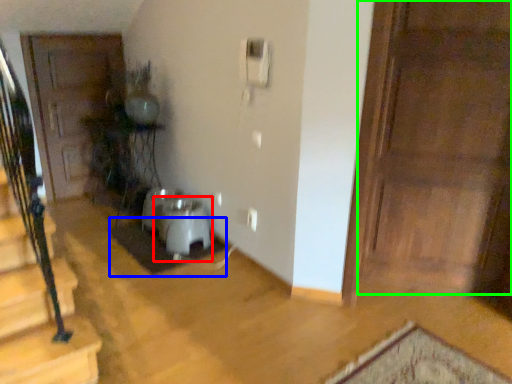
Question: Which is nearer to the water heater (highlighted by a red box)? doormat (highlighted by a blue box) or door (highlighted by a green box).

Choices:
 (A) doormat
 (B) door

Answer: (A)